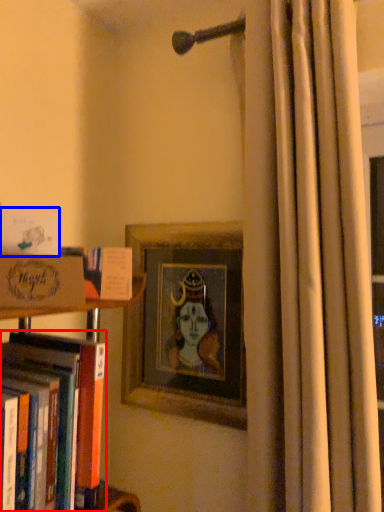
Question: Which object is further to the camera taking this photo, book (highlighted by a red box) or book (highlighted by a blue box)?

Choices:
 (A) book
 (B) book

Answer: (B)